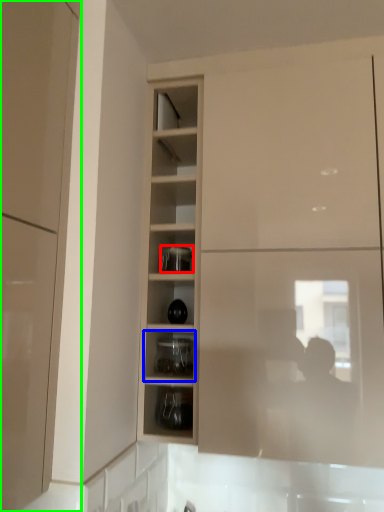
Question: Based on their relative distances, which object is farther from appliance (highlighted by a red box)? Choose from shelf (highlighted by a blue box) and cabinetry (highlighted by a green box).

Choices:
 (A) shelf
 (B) cabinetry

Answer: (B)